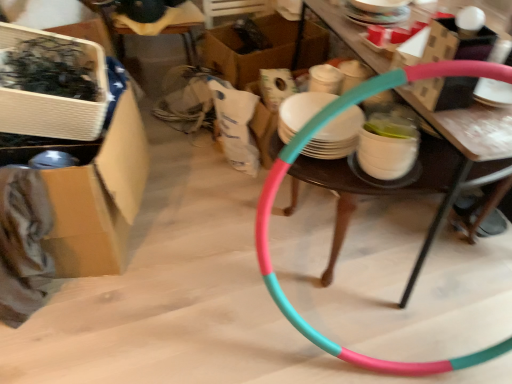
The width and height of the screenshot is (512, 384). Find the location of `free space that is to the left of pink rubber hula hoop at center`. free space that is to the left of pink rubber hula hoop at center is located at coordinates (x=199, y=236).